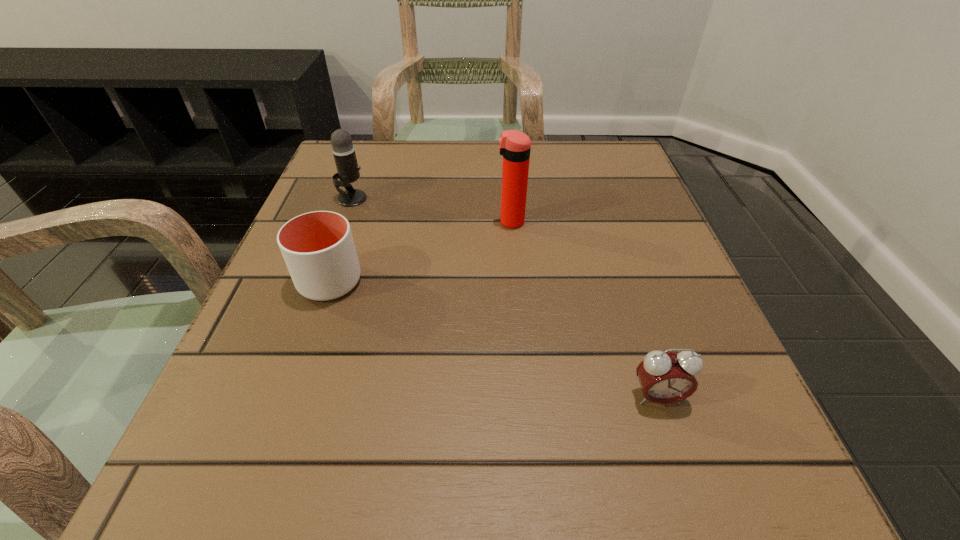
This screenshot has width=960, height=540. Identify the location of vacant region located 0.080m on the clock face of the rightmost object. (682, 471).

Locate an element on the screen. This screenshot has width=960, height=540. object that is at the far edge is located at coordinates (343, 150).

Identify the location of microphone that is at the left edge. This screenshot has height=540, width=960. (343, 150).

The width and height of the screenshot is (960, 540). Identify the location of cup that is positioned at the left edge. (318, 248).

Where is `object located at the right edge`? object located at the right edge is located at coordinates (665, 377).

You are a GUI agent. You are given a task and a screenshot of the screen. Output one action in this format:
    pyautogui.click(x=<x>, y=<y>)
    Task: Click on the object that is at the far left corner
    This screenshot has width=960, height=540.
    Given the screenshot: What is the action you would take?
    pyautogui.click(x=343, y=150)

The height and width of the screenshot is (540, 960). Find the location of `blank space at the far edge of the desktop`. blank space at the far edge of the desktop is located at coordinates 393,191.

The width and height of the screenshot is (960, 540). Find the location of `free space at the near edge of the desktop`. free space at the near edge of the desktop is located at coordinates (585, 465).

Find the location of a particular element. free space at the left edge of the desktop is located at coordinates (197, 442).

Identify the location of free space at the right edge. The height and width of the screenshot is (540, 960). (725, 422).